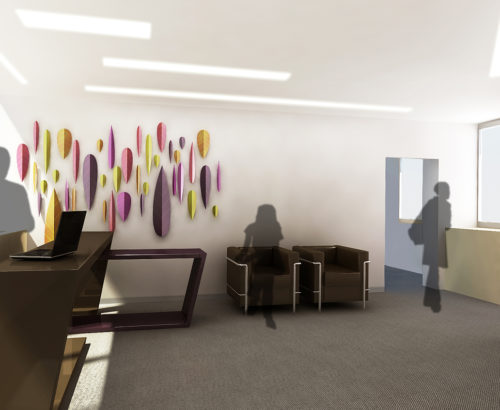
Find the location of a particular element. The image size is (500, 410). wood counter is located at coordinates (61, 264).